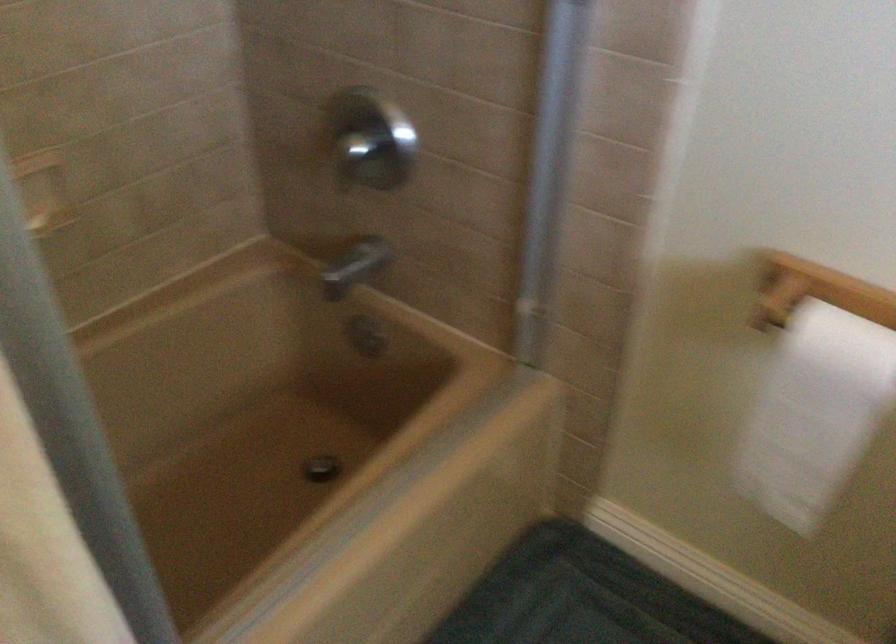
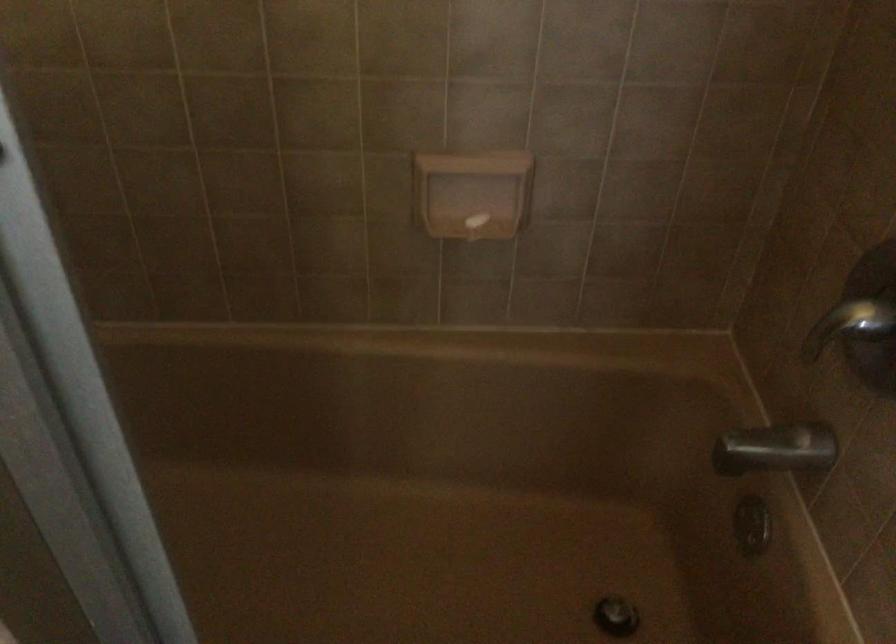
Locate, in the second image, the point that corresponds to point 359,268 in the first image.

(776, 449)